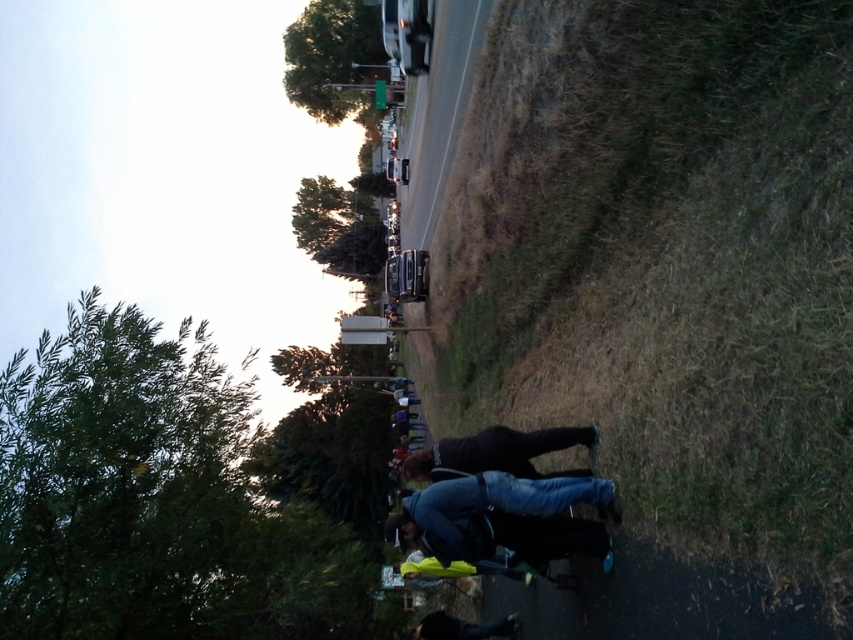
Is point (573, 188) more distant than point (416, 496)?

Yes, it is.

Can you confirm if dry grass at right is positioned to the right of dark blue denim jeans at lower center?

Correct, you'll find dry grass at right to the right of dark blue denim jeans at lower center.

Measure the distance between dry grass at right and camera.

dry grass at right is 11.11 feet from camera.

You are a GUI agent. You are given a task and a screenshot of the screen. Output one action in this format:
    pyautogui.click(x=<x>, y=<y>)
    Task: Click on the dry grass at right
    Image resolution: width=853 pixels, height=640 pixels.
    Given the screenshot: What is the action you would take?
    pyautogui.click(x=666, y=292)

Describe the element at coordinates (666, 292) in the screenshot. I see `dry grass at right` at that location.

Who is taller, dry grass at right or dark gray smooth skateboard at center?

Standing taller between the two is dry grass at right.

This screenshot has width=853, height=640. I want to click on dry grass at right, so click(x=666, y=292).

Find the location of a particular element. dry grass at right is located at coordinates (666, 292).

Which is behind, point (444, 532) or point (585, 440)?

Point (585, 440)

Between dark blue denim jeans at lower center and dark gray smooth skateboard at center, which one has less height?

dark gray smooth skateboard at center is shorter.

Where is `dark blue denim jeans at lower center`? The height and width of the screenshot is (640, 853). dark blue denim jeans at lower center is located at coordinates (502, 516).